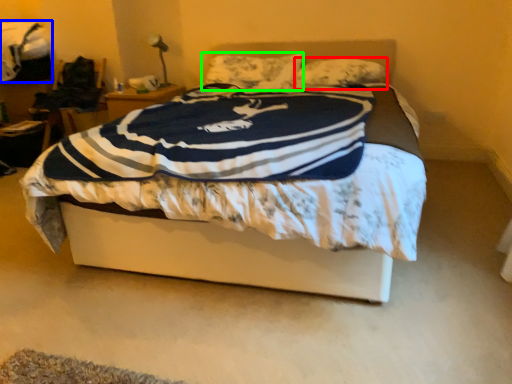
Question: Estimate the real-world distances between objects in this image. Which object is farther from pillow (highlighted by a red box), blanket (highlighted by a blue box) or pillow (highlighted by a green box)?

Choices:
 (A) blanket
 (B) pillow

Answer: (A)